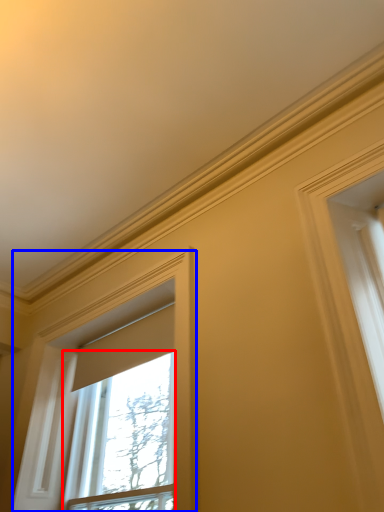
Question: Which object is closer to the camera taking this photo, window (highlighted by a red box) or window (highlighted by a blue box)?

Choices:
 (A) window
 (B) window

Answer: (B)